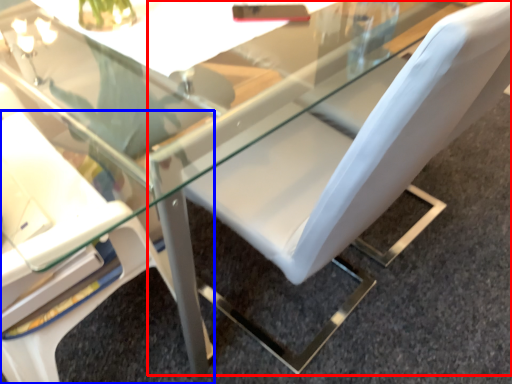
Question: Among these objects, which one is farthest to the camera, chair (highlighted by a red box) or chair (highlighted by a blue box)?

Choices:
 (A) chair
 (B) chair

Answer: (A)